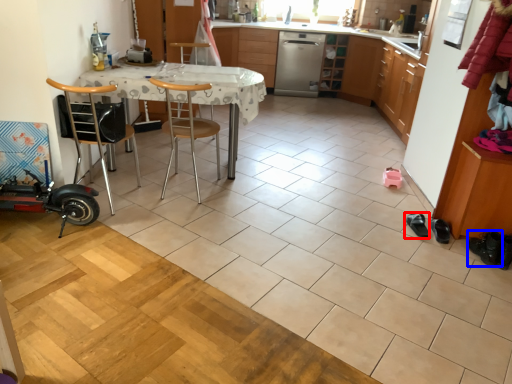
Question: Which of the following is the closest to the observer, footwear (highlighted by a red box) or footwear (highlighted by a blue box)?

Choices:
 (A) footwear
 (B) footwear

Answer: (B)